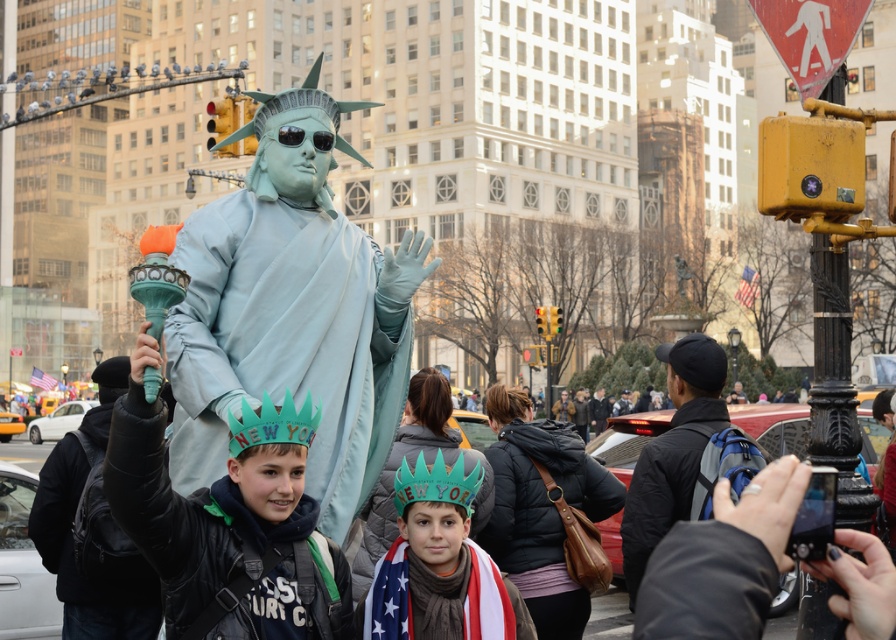
You are a photographer standing at the center of the scene. You want to take a photo that includes both the Statue of Liberty costume and the two children. Which of the two children, the one at point (283, 572) or the one at point (503, 435), is closer to the camera?

The child at point (283, 572) is closer to the camera because point (283, 572) is in front of point (503, 435).